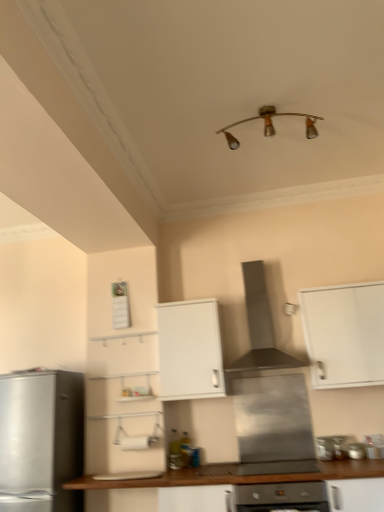
Identify the location of white matte cabinet at upper right, which appears as the 2th cabinetry when viewed from the left. (345, 334).

Measure the distance between point (318, 442) and camera.

The distance of point (318, 442) from camera is 11.09 feet.

Measure the distance between point [250,397] and camera.

Point [250,397] and camera are 3.57 meters apart from each other.

Describe the element at coordinates (260, 326) in the screenshot. I see `stainless steel range hood at center` at that location.

This screenshot has width=384, height=512. I want to click on gold metallic light fixture at upper center, so click(x=270, y=125).

Where is `white matte cabinet at upper right, which appears as the 2th cabinetry when viewed from the left`? This screenshot has width=384, height=512. white matte cabinet at upper right, which appears as the 2th cabinetry when viewed from the left is located at coordinates (345, 334).

From a real-world perspective, relative to wooden countertop at lower center, is stainless steel range hood at center, the 3th appliance viewed from the right, vertically above or below?

stainless steel range hood at center, the 3th appliance viewed from the right, is situated higher than wooden countertop at lower center in the real world.

Is stainless steel range hood at center, the 3th appliance viewed from the right, oriented towards wooden countertop at lower center?

No, stainless steel range hood at center, the 3th appliance viewed from the right, is not oriented towards wooden countertop at lower center.

From the image's perspective, which one is positioned higher, wooden countertop at lower center or stainless steel range hood at center?

stainless steel range hood at center is shown above in the image.

What's the angular difference between wooden countertop at lower center and stainless steel range hood at center's facing directions?

2.94e-05 degrees separate the facing orientations of wooden countertop at lower center and stainless steel range hood at center.

Is wooden countertop at lower center not within stainless steel range hood at center?

Yes, wooden countertop at lower center is located beyond the bounds of stainless steel range hood at center.

How far apart are metallic silver stove at lower center, the 3th appliance in the left-to-right sequence, and white matte cabinet at center, the 2th cabinetry in the right-to-left sequence?

metallic silver stove at lower center, the 3th appliance in the left-to-right sequence, is 4.34 feet from white matte cabinet at center, the 2th cabinetry in the right-to-left sequence.

Where is `cabinetry that is the 1st object located above the metallic silver stove at lower center, the 3th appliance in the left-to-right sequence (from the image's perspective)`? Image resolution: width=384 pixels, height=512 pixels. cabinetry that is the 1st object located above the metallic silver stove at lower center, the 3th appliance in the left-to-right sequence (from the image's perspective) is located at coordinates (190, 350).

Considering the sizes of objects metallic silver stove at lower center, the 3th appliance in the left-to-right sequence, and white matte cabinet at center, the 2th cabinetry in the right-to-left sequence, in the image provided, who is shorter, metallic silver stove at lower center, the 3th appliance in the left-to-right sequence, or white matte cabinet at center, the 2th cabinetry in the right-to-left sequence,?

With less height is metallic silver stove at lower center, the 3th appliance in the left-to-right sequence.

In terms of size, does silver metallic refrigerator at left appear bigger or smaller than wooden countertop at lower center?

silver metallic refrigerator at left is smaller than wooden countertop at lower center.

Does point (67, 508) appear closer or farther from the camera than point (217, 467)?

Clearly, point (67, 508) is closer to the camera than point (217, 467).

Considering the sizes of silver metallic refrigerator at left and wooden countertop at lower center in the image, is silver metallic refrigerator at left taller or shorter than wooden countertop at lower center?

silver metallic refrigerator at left is taller than wooden countertop at lower center.

From the image's perspective, is wooden countertop at lower center over white matte cabinet at upper right, which appears as the 2th cabinetry when viewed from the left?

No, from the image's perspective, wooden countertop at lower center is not on top of white matte cabinet at upper right, which appears as the 2th cabinetry when viewed from the left.

Considering the positions of objects wooden countertop at lower center and white matte cabinet at upper right, positioned as the first cabinetry in right-to-left order, in the image provided, who is more to the left, wooden countertop at lower center or white matte cabinet at upper right, positioned as the first cabinetry in right-to-left order,?

wooden countertop at lower center is more to the left.

From a real-world perspective, does wooden countertop at lower center stand above white matte cabinet at upper right, which appears as the 2th cabinetry when viewed from the left?

No, from a real-world perspective, wooden countertop at lower center is not over white matte cabinet at upper right, which appears as the 2th cabinetry when viewed from the left

Does wooden countertop at lower center contain white matte cabinet at upper right, positioned as the first cabinetry in right-to-left order?

No, white matte cabinet at upper right, positioned as the first cabinetry in right-to-left order, is not inside wooden countertop at lower center.

From their relative heights in the image, would you say metallic silver stove at lower center, which ranks as the second appliance in left-to-right order, is taller or shorter than white matte cabinet at upper right, which appears as the 2th cabinetry when viewed from the left?

metallic silver stove at lower center, which ranks as the second appliance in left-to-right order, is shorter than white matte cabinet at upper right, which appears as the 2th cabinetry when viewed from the left.

From a real-world perspective, is metallic silver stove at lower center, which is the 2th appliance from right to left, positioned above or below white matte cabinet at upper right, which appears as the 2th cabinetry when viewed from the left?

From a real-world perspective, metallic silver stove at lower center, which is the 2th appliance from right to left, is physically below white matte cabinet at upper right, which appears as the 2th cabinetry when viewed from the left.

Identify the location of cabinetry that appears on the right of metallic silver stove at lower center, which ranks as the second appliance in left-to-right order. point(345,334).

Which object is positioned more to the right, metallic silver stove at lower center, which is the 2th appliance from right to left, or white matte cabinet at upper right, positioned as the first cabinetry in right-to-left order?

white matte cabinet at upper right, positioned as the first cabinetry in right-to-left order, is more to the right.

Between white matte cabinet at upper right, which appears as the 2th cabinetry when viewed from the left, and wooden countertop at lower center, which one has smaller width?

white matte cabinet at upper right, which appears as the 2th cabinetry when viewed from the left, is thinner.

Would you say white matte cabinet at upper right, positioned as the first cabinetry in right-to-left order, contains wooden countertop at lower center?

That's incorrect, wooden countertop at lower center is not inside white matte cabinet at upper right, positioned as the first cabinetry in right-to-left order.

Looking at this image, from a real-world perspective, who is located higher, white matte cabinet at upper right, positioned as the first cabinetry in right-to-left order, or wooden countertop at lower center?

From a 3D spatial view, white matte cabinet at upper right, positioned as the first cabinetry in right-to-left order, is above.

In the image, there is a white matte cabinet at upper right, positioned as the first cabinetry in right-to-left order. Where is `countertop below it (from a real-world perspective)`? countertop below it (from a real-world perspective) is located at coordinates (243, 474).

Which appliance is the 1st one when counting from the right side of the wooden countertop at lower center? Please provide its 2D coordinates.

[(272, 418)]

Identify the location of countertop in front of the stainless steel range hood at center. (243, 474).

Based on their spatial positions, is wooden countertop at lower center or stainless steel range hood at center closer to white matte cabinet at upper right, positioned as the first cabinetry in right-to-left order?

stainless steel range hood at center is positioned closer to the anchor white matte cabinet at upper right, positioned as the first cabinetry in right-to-left order.

Looking at the image, which one is located further to white matte cabinet at center, which ranks as the 1th cabinetry in left-to-right order, silver metallic refrigerator at left or stainless steel range hood at center, the 3th appliance viewed from the right?

A: Among the two, silver metallic refrigerator at left is located further to white matte cabinet at center, which ranks as the 1th cabinetry in left-to-right order.

When comparing their distances from stainless steel range hood at center, does metallic silver stove at lower center, which is the 2th appliance from right to left, or silver metallic refrigerator at left seem further?

silver metallic refrigerator at left.

Based on their spatial positions, is satin silver oven at center or metallic silver stove at lower center, which ranks as the second appliance in left-to-right order, closer to metallic silver stove at lower center, which is counted as the 1th appliance, starting from the right?

metallic silver stove at lower center, which ranks as the second appliance in left-to-right order, is closer to metallic silver stove at lower center, which is counted as the 1th appliance, starting from the right.

Consider the image. From the image, which object appears to be farther from wooden countertop at lower center, stainless steel range hood at center or silver metallic refrigerator at left?

stainless steel range hood at center lies further to wooden countertop at lower center than the other object.

Based on their spatial positions, is satin silver oven at center or metallic silver stove at lower center, which is the 2th appliance from right to left, further from stainless steel range hood at center, placed as the 1th appliance when sorted from left to right?

satin silver oven at center.

Looking at the image, which one is located closer to satin silver oven at center, metallic silver stove at lower center, which is the 2th appliance from right to left, or metallic silver stove at lower center, which is counted as the 1th appliance, starting from the right?

metallic silver stove at lower center, which is the 2th appliance from right to left, is closer to satin silver oven at center.

Which object lies nearer to the anchor point stainless steel range hood at center, satin silver oven at center or wooden countertop at lower center?

Based on the image, wooden countertop at lower center appears to be nearer to stainless steel range hood at center.

Locate an element on the screen. home appliance between gold metallic light fixture at upper center and metallic silver stove at lower center, the 3th appliance in the left-to-right sequence, in the vertical direction is located at coordinates (260, 326).

Find the location of a particular element. cabinetry between silver metallic refrigerator at left and wooden countertop at lower center is located at coordinates (190, 350).

This screenshot has height=512, width=384. In order to click on countertop between white matte cabinet at center, the 2th cabinetry in the right-to-left sequence, and white matte cabinet at upper right, which appears as the 2th cabinetry when viewed from the left, from left to right in this screenshot , I will do `click(243, 474)`.

This screenshot has width=384, height=512. In order to click on countertop between white matte cabinet at center, which ranks as the 1th cabinetry in left-to-right order, and metallic silver stove at lower center, which is counted as the 1th appliance, starting from the right, in the horizontal direction in this screenshot , I will do `click(243, 474)`.